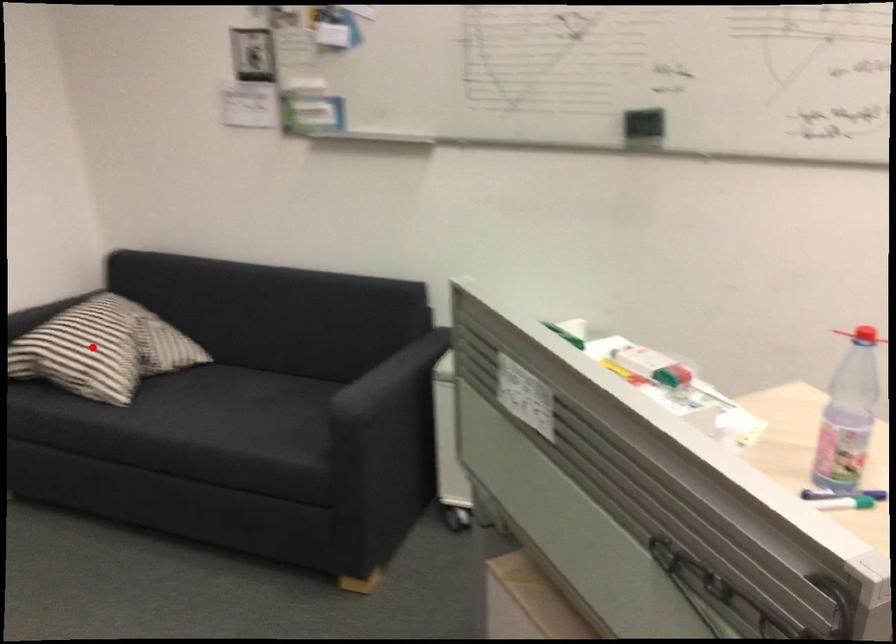
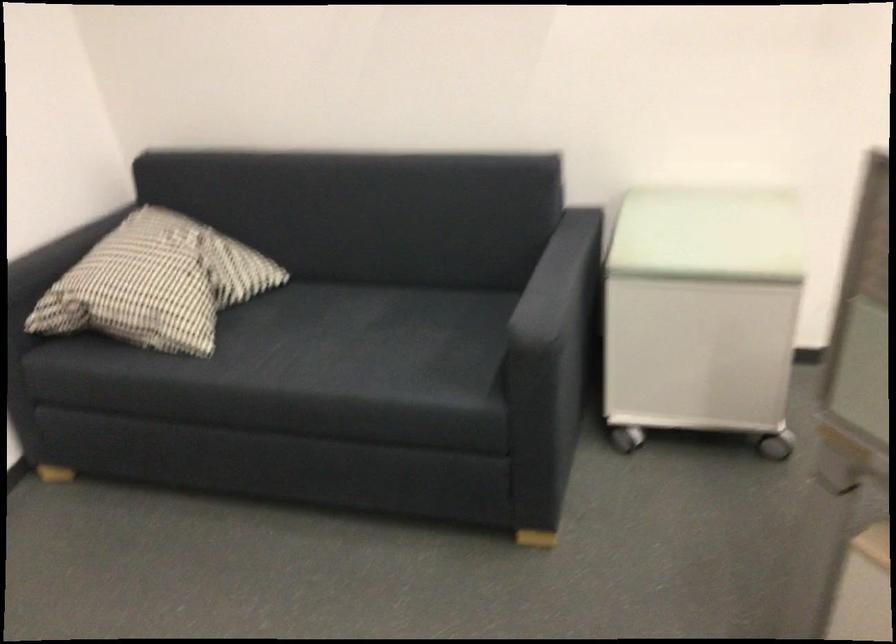
Locate, in the second image, the point that corresponds to the highlighted location in the first image.

(156, 283)